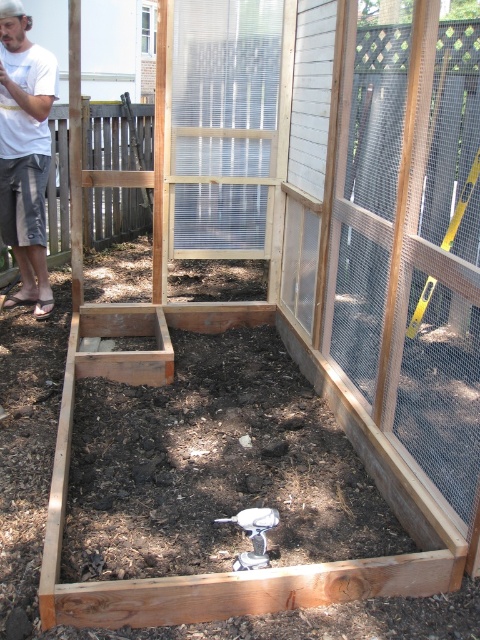
You are standing in front of the partially constructed wooden structure. You need to locate the clear plastic screen door at center. Where is it positioned relative to the structure?

The clear plastic screen door at center is positioned at the center of the structure, specifically at the coordinates point (227, 124).

You are a contractor assessing the construction site. You notice the clear plastic screen door at center and the white cotton shirt at upper left. Which object is taller?

→ The white cotton shirt at upper left is taller than the clear plastic screen door at center.

You are planning to hang a decorative banner that requires a support structure. Given the clear plastic screen door at center and the white cotton shirt at upper left, which object would be more suitable for attaching the banner based on their sizes?

The clear plastic screen door at center is wider than the white cotton shirt at upper left, so it would be more suitable for attaching the banner as it provides a larger and sturdier surface area.